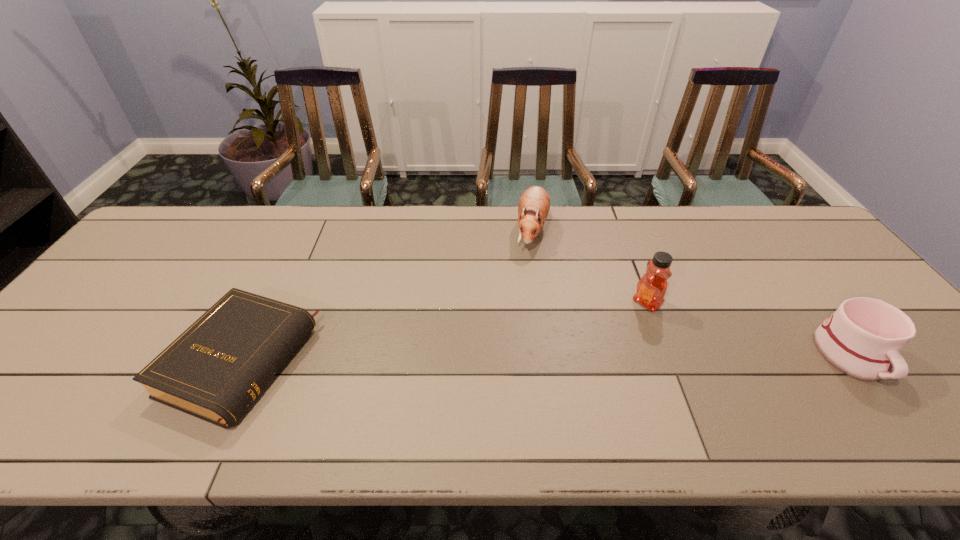
You are a GUI agent. You are given a task and a screenshot of the screen. Output one action in this format:
    pyautogui.click(x=<x>, y=<y>)
    Task: Click on the empty location between the mug and the honey
    
    Given the screenshot: What is the action you would take?
    pyautogui.click(x=750, y=329)

Where is `free area in between the mug and the second object from left to right`? The height and width of the screenshot is (540, 960). free area in between the mug and the second object from left to right is located at coordinates (692, 293).

Locate which object is the second closest to the shortest object. Please provide its 2D coordinates. Your answer should be formatted as a tuple, i.e. [(x, y)], where the tuple contains the x and y coordinates of a point satisfying the conditions above.

[(651, 288)]

At what (x,y) coordinates should I click in order to perform the action: click on the third closest object to the third object from left to right. Please return your answer as a coordinate pair (x, y). Image resolution: width=960 pixels, height=540 pixels. Looking at the image, I should click on (215, 369).

Identify the location of free space that satisfies the following two spatial constraints: 1. on the back side of the shortest object; 2. on the right side of the third object from left to right. (269, 303).

Locate an element on the screen. vacant area in the image that satisfies the following two spatial constraints: 1. on the back side of the second object from right to left; 2. on the right side of the shortest object is located at coordinates (269, 303).